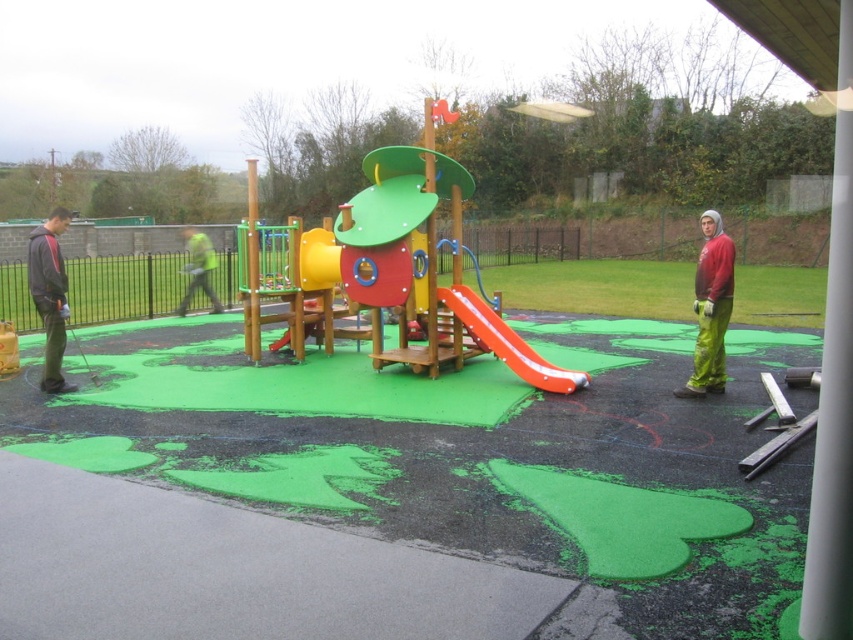
You are a maintenance worker responsible for the playground. You need to place a 1.2 meter wide equipment box between the red matte jacket at right and the dark gray hoodie at left. Can the box fit between them?

→ The red matte jacket at right might be wider than dark gray hoodie at left, so the 1.2 meter wide equipment box may or may not fit between them depending on the exact width difference. Check the actual distance before placing the box.

You are a parent trying to decide whether to let your child play on the playground. You notice the dark gray hoodie at left and the rubber smooth slide at center. Which object is wider?

The dark gray hoodie at left is wider than the rubber smooth slide at center.